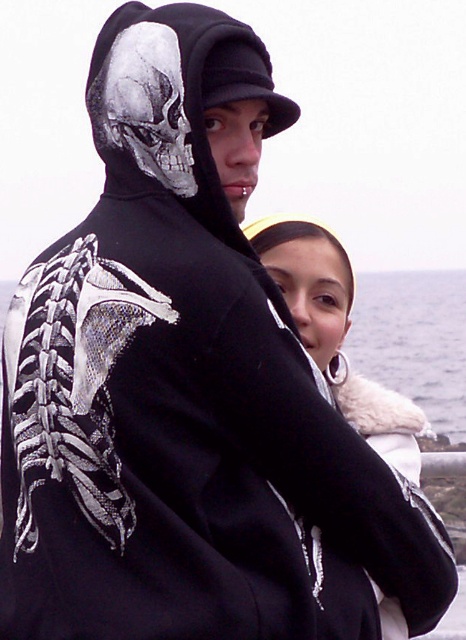
Question: Does smooth white fur at center have a larger size compared to gray matte skull at upper left?

Choices:
 (A) yes
 (B) no

Answer: (A)

Question: Among these points, which one is farthest from the camera?

Choices:
 (A) (117, 44)
 (B) (322, 227)

Answer: (B)

Question: Is smooth white fur at center smaller than gray matte skull at upper left?

Choices:
 (A) no
 (B) yes

Answer: (A)

Question: Which point is farther to the camera?

Choices:
 (A) (415, 438)
 (B) (158, 45)

Answer: (A)

Question: Does smooth white fur at center appear under gray matte skull at upper left?

Choices:
 (A) yes
 (B) no

Answer: (A)